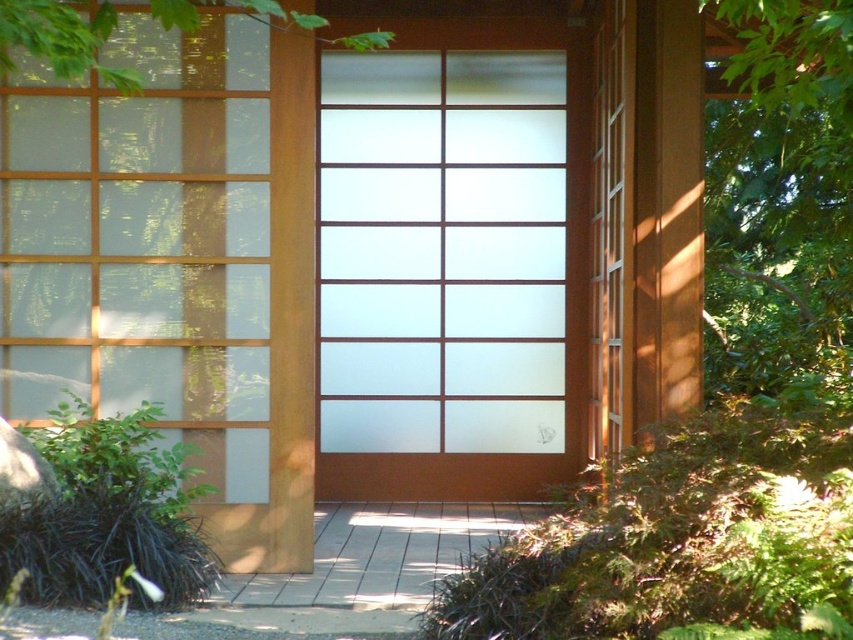
You are standing in front of the traditional Japanese structure and want to know if the frosted glass window at left is protected from direct sunlight by the green leafy tree at upper left. Based on their positions, can you determine this?

The frosted glass window at left is positioned under the green leafy tree at upper left, so it is likely protected from direct sunlight by the tree.

You are standing in front of the traditional Japanese structure and notice the frosted glass window at left and the green leafy tree at upper left. From your perspective, which object is positioned to the left side?

The frosted glass window at left is positioned to the left of the green leafy tree at upper left, so the frosted glass window at left is on the left side.